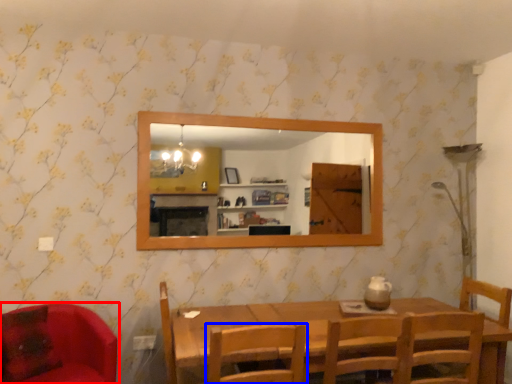
Question: Which point is further to the camera, chair (highlighted by a red box) or chair (highlighted by a blue box)?

Choices:
 (A) chair
 (B) chair

Answer: (A)